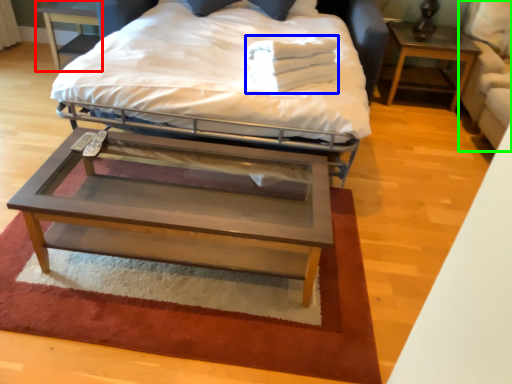
Question: Which object is positioned closest to nightstand (highlighted by a red box)? Select from material (highlighted by a blue box) and swivel chair (highlighted by a green box).

Choices:
 (A) material
 (B) swivel chair

Answer: (A)